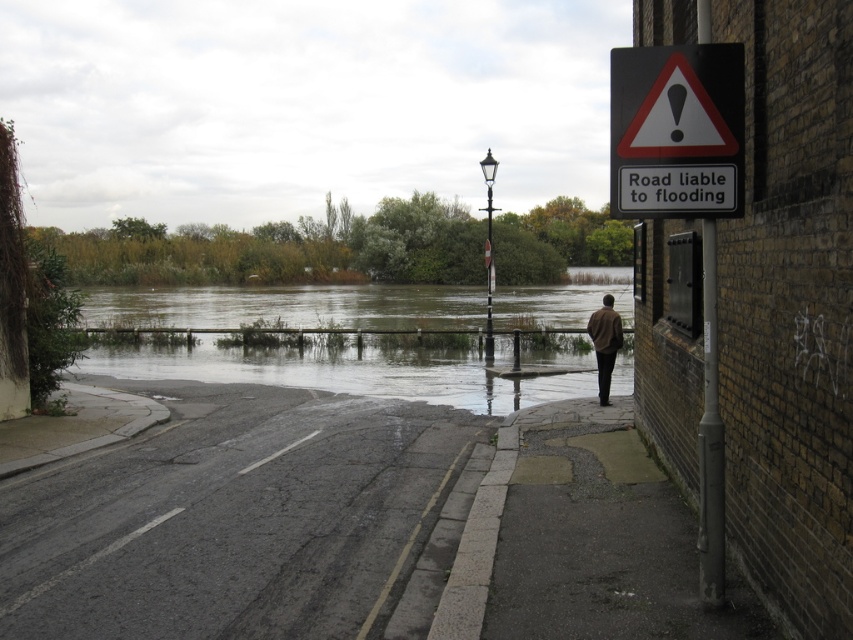
Question: Which point appears closest to the camera in this image?

Choices:
 (A) [x=200, y=550]
 (B) [x=595, y=346]
 (C) [x=438, y=348]
 (D) [x=724, y=88]

Answer: (D)

Question: Which of the following is the farthest from the observer?

Choices:
 (A) (601, 337)
 (B) (192, 502)

Answer: (A)

Question: Which point is closer to the camera?

Choices:
 (A) (247, 515)
 (B) (601, 394)
 (C) (694, 88)

Answer: (C)

Question: Is the position of brown wooden fence at center less distant than that of brown leather jacket at lower right?

Choices:
 (A) yes
 (B) no

Answer: (B)

Question: In this image, where is brown wooden fence at center located relative to black plastic sign at upper right?

Choices:
 (A) above
 (B) below

Answer: (A)

Question: Is gray asphalt pavement at lower center positioned in front of brown leather jacket at lower right?

Choices:
 (A) yes
 (B) no

Answer: (A)